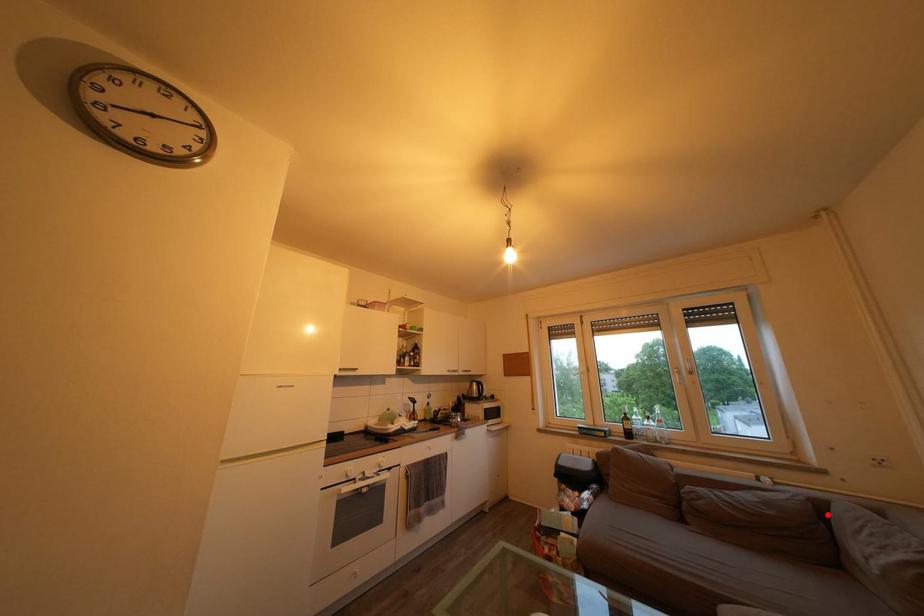
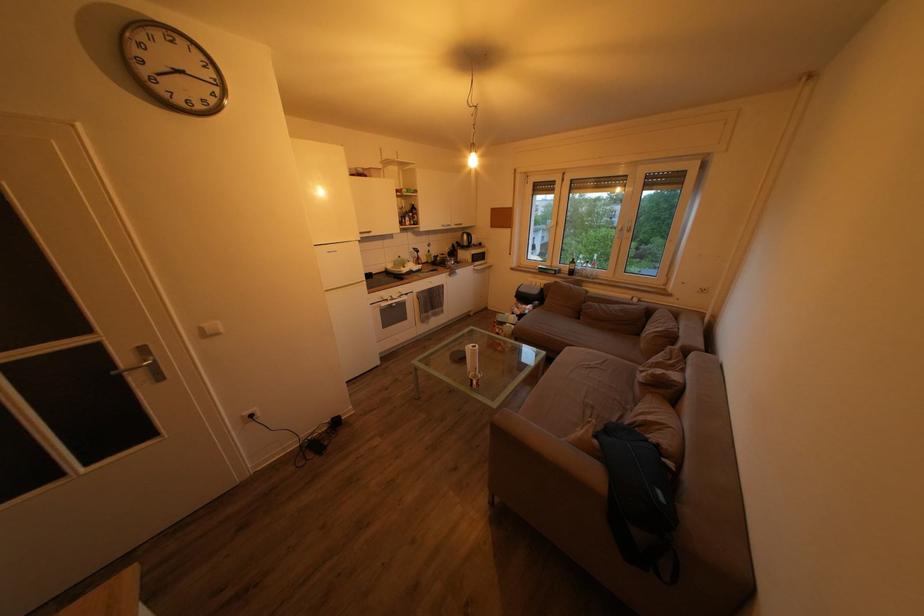
Find the pixel in the second image that matches the highlighted location in the first image.

(657, 318)